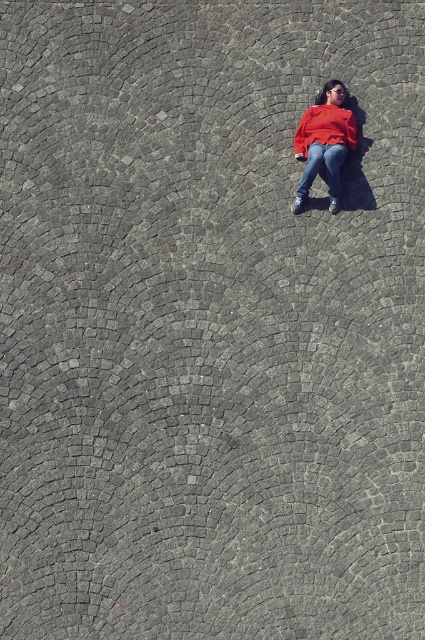
You are a photographer taking a picture of the cobblestone pavement from above. You notice the matte red sweater at center and jeans at center. Which object takes up more space in the photo?

The matte red sweater at center is larger in size than jeans at center, so it takes up more space in the photo.

You are a photographer taking a picture of the cobblestone pavement and the person lying on it. You notice two red items at the center of the image. Which one is more to the left, the matte red sweater at center or the matte red sweatshirt at center?

The matte red sweater at center is positioned on the left side of the matte red sweatshirt at center, so the matte red sweater at center is more to the left.